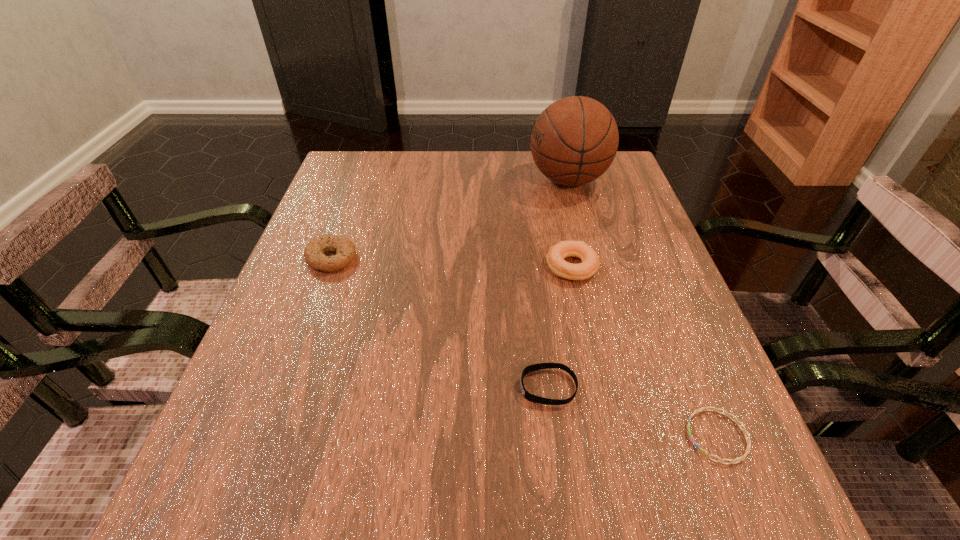
The image size is (960, 540). Find the location of `vacant space at the near left corner`. vacant space at the near left corner is located at coordinates (254, 472).

The image size is (960, 540). In the image, there is a desktop. Find the location of `vacant space at the far right corner`. vacant space at the far right corner is located at coordinates (595, 191).

Image resolution: width=960 pixels, height=540 pixels. Find the location of `free space at the near right corner`. free space at the near right corner is located at coordinates (706, 494).

You are a GUI agent. You are given a task and a screenshot of the screen. Output one action in this format:
    pyautogui.click(x=<x>, y=<y>)
    Task: Click on the empty space that is in between the farthest object and the left bagel
    Image resolution: width=960 pixels, height=540 pixels.
    Given the screenshot: What is the action you would take?
    pyautogui.click(x=450, y=219)

I want to click on free space that is in between the farthest object and the bracelet, so click(642, 308).

The width and height of the screenshot is (960, 540). I want to click on free space between the right bagel and the farthest object, so click(570, 223).

Where is `vacant area between the shortest object and the wristband`? vacant area between the shortest object and the wristband is located at coordinates (633, 411).

Locate an element on the screen. The image size is (960, 540). free space that is in between the second nearest object and the farthest object is located at coordinates (558, 283).

I want to click on vacant space that is in between the leftmost object and the fourth farthest object, so click(x=440, y=322).

Find the location of a particular element. The width and height of the screenshot is (960, 540). empty space that is in between the leftmost object and the right bagel is located at coordinates (452, 262).